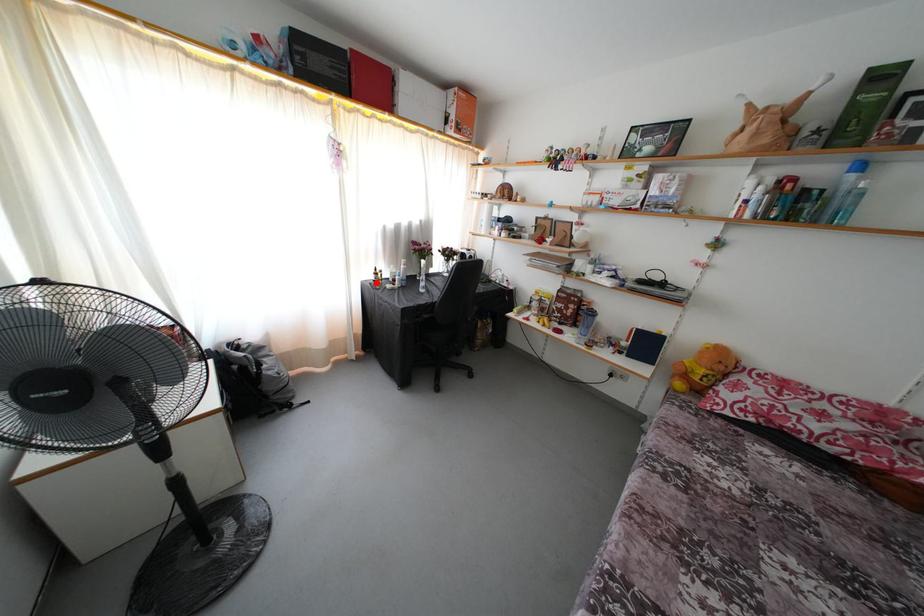
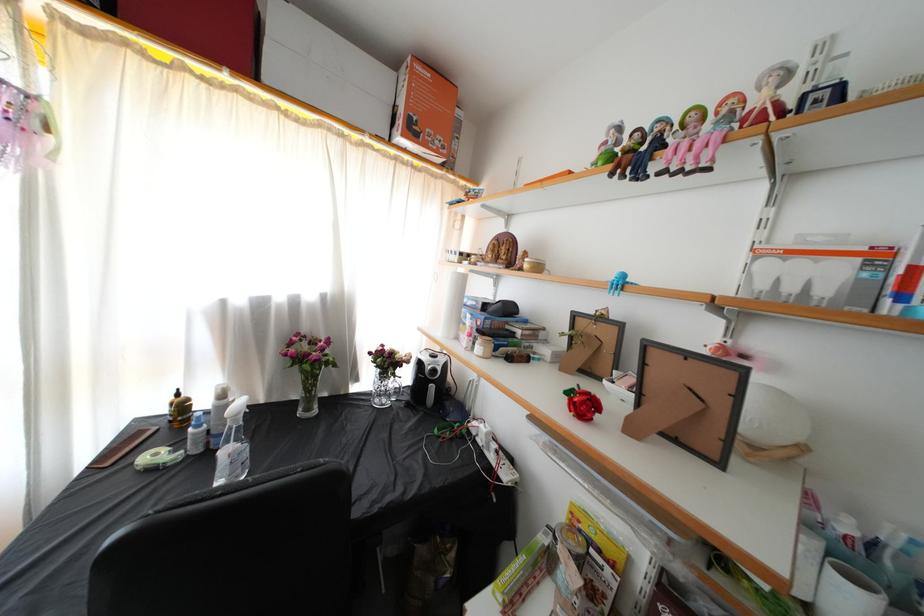
Where in the second image is the point corresponding to the highlighted location from the first image?

(171, 416)